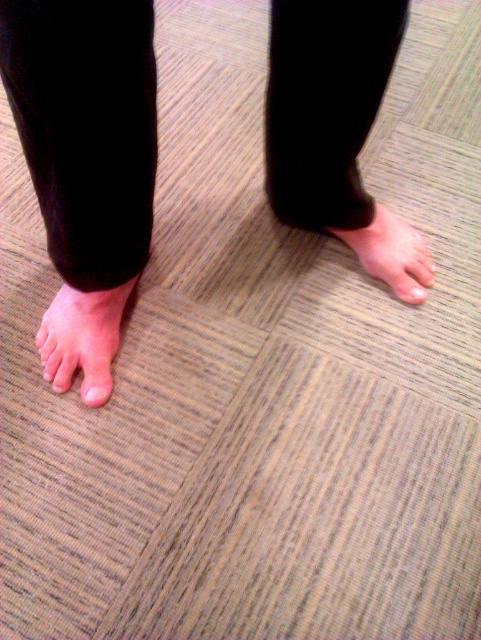
You are designing a shoe that needs to accommodate both the pink skin at center and the white matte toe at lower left. Based on their heights, which one requires a taller compartment in the shoe design?

The pink skin at center requires a taller compartment in the shoe design because it is much taller than the white matte toe at lower left as described.